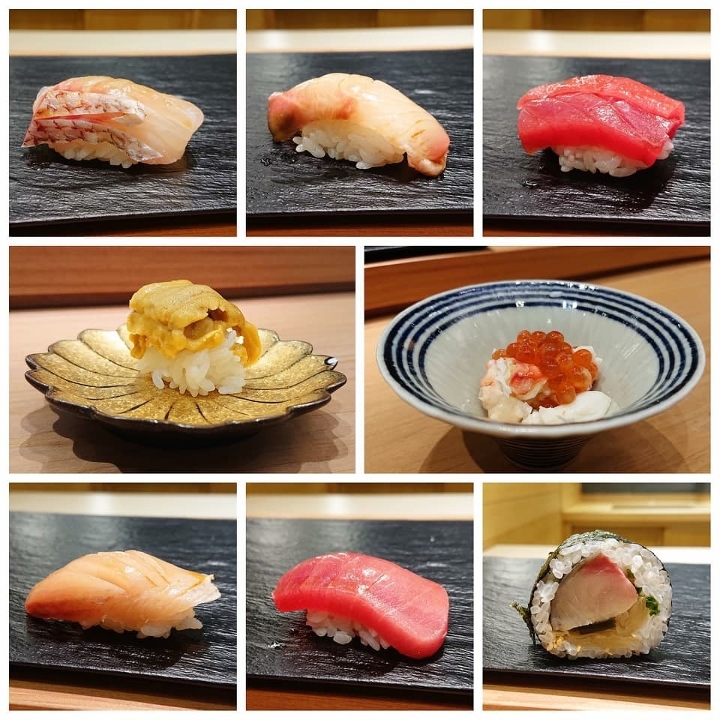
Image resolution: width=720 pixels, height=720 pixels. Find the location of `individual picture`. individual picture is located at coordinates (189, 66), (364, 45), (590, 45), (652, 271), (333, 284), (204, 521), (374, 515), (554, 512).